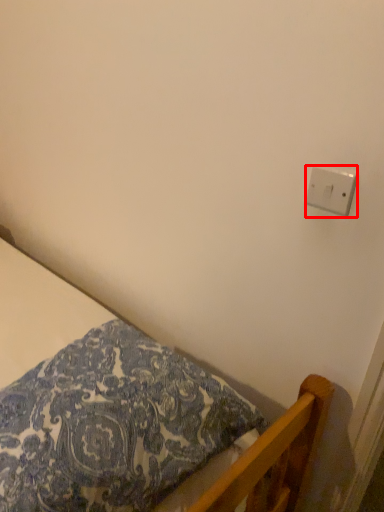
Question: In this image, where is light switch (annotated by the red box) located relative to bed?

Choices:
 (A) right
 (B) left

Answer: (A)